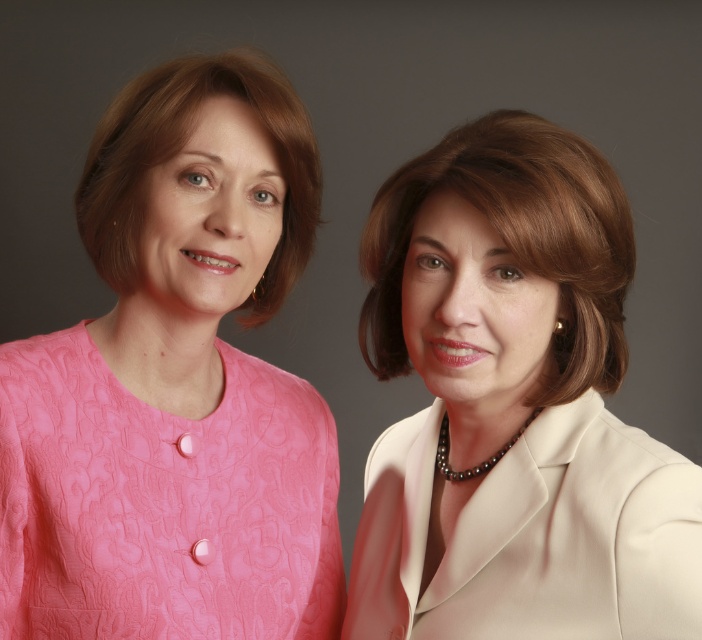
Question: Which point is farther from the camera taking this photo?

Choices:
 (A) (675, 576)
 (B) (192, 604)
 (C) (442, 445)

Answer: (C)

Question: Does white satin blazer at center appear under white satin blazer at right?

Choices:
 (A) no
 (B) yes

Answer: (A)

Question: Does pink textured dress at left have a smaller size compared to white satin blazer at right?

Choices:
 (A) yes
 (B) no

Answer: (B)

Question: Which point is closer to the camera?

Choices:
 (A) white satin blazer at center
 (B) white satin blazer at right

Answer: (A)

Question: Considering the real-world distances, which object is closest to the white satin blazer at center?

Choices:
 (A) pink textured dress at left
 (B) white satin blazer at right

Answer: (B)

Question: Is pink textured dress at left wider than white satin blazer at right?

Choices:
 (A) no
 (B) yes

Answer: (B)